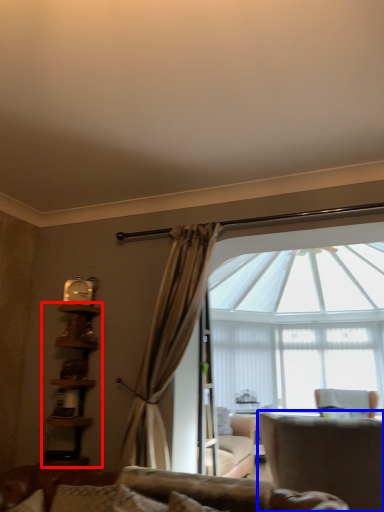
Question: Which object appears closest to the camera in this image, bookshelf (highlighted by a red box) or chair (highlighted by a blue box)?

Choices:
 (A) bookshelf
 (B) chair

Answer: (B)